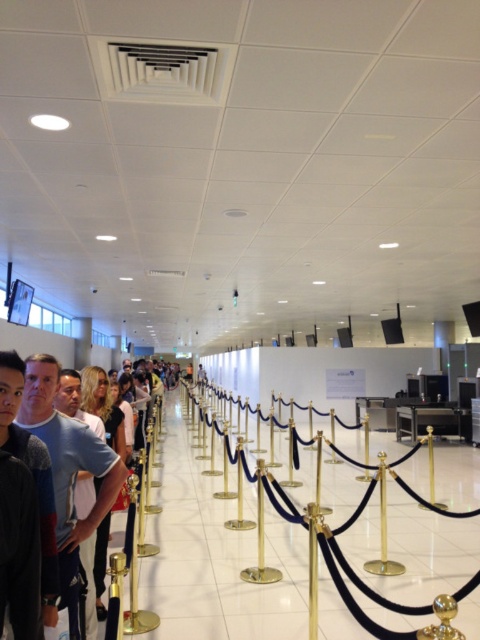
Question: Estimate the real-world distances between objects in this image. Which object is farther from the gold polished ball at center?

Choices:
 (A) dark gray sweater at center
 (B) matte blue shirt at center

Answer: (B)

Question: Among these points, which one is farthest from the camera?

Choices:
 (A) (437, 612)
 (B) (66, 426)
 (C) (0, 433)

Answer: (B)

Question: Estimate the real-world distances between objects in this image. Which object is closer to the dark gray sweater at center?

Choices:
 (A) matte blue shirt at center
 (B) gold polished ball at center

Answer: (A)

Question: Is dark gray sweater at center closer to camera compared to gold polished ball at center?

Choices:
 (A) yes
 (B) no

Answer: (B)

Question: Observing the image, what is the correct spatial positioning of matte blue shirt at center in reference to gold polished ball at center?

Choices:
 (A) left
 (B) right

Answer: (A)

Question: Does matte blue shirt at center have a larger size compared to dark gray sweater at center?

Choices:
 (A) no
 (B) yes

Answer: (B)